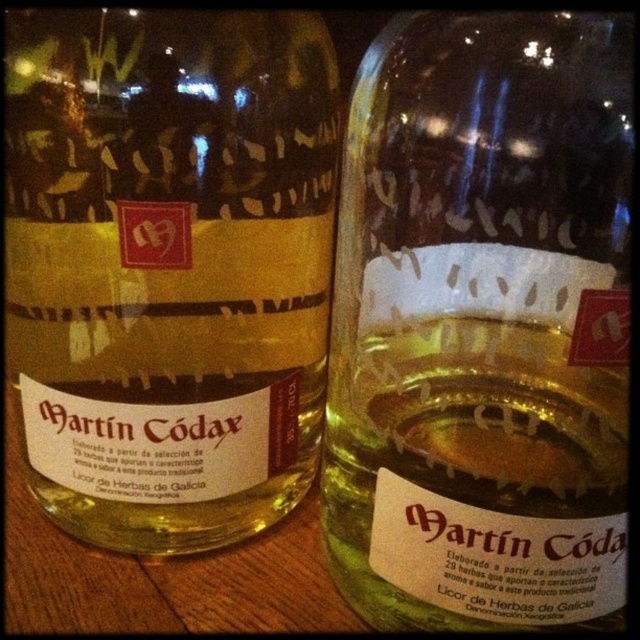
Is translucent glass bottle at center wider than matte glass bottle at center?

In fact, translucent glass bottle at center might be narrower than matte glass bottle at center.

Is translucent glass bottle at center taller than matte glass bottle at center?

No, translucent glass bottle at center is not taller than matte glass bottle at center.

Is point (436, 118) in front of point (284, 509)?

Yes, point (436, 118) is closer to viewer.

You are a GUI agent. You are given a task and a screenshot of the screen. Output one action in this format:
    pyautogui.click(x=<x>, y=<y>)
    Task: Click on the translucent glass bottle at center
    
    Given the screenshot: What is the action you would take?
    pyautogui.click(x=483, y=324)